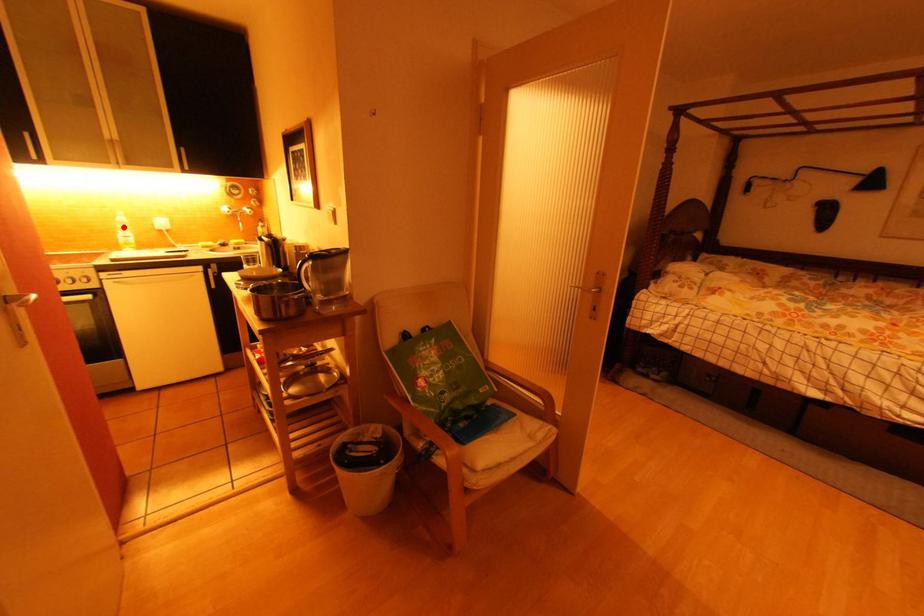
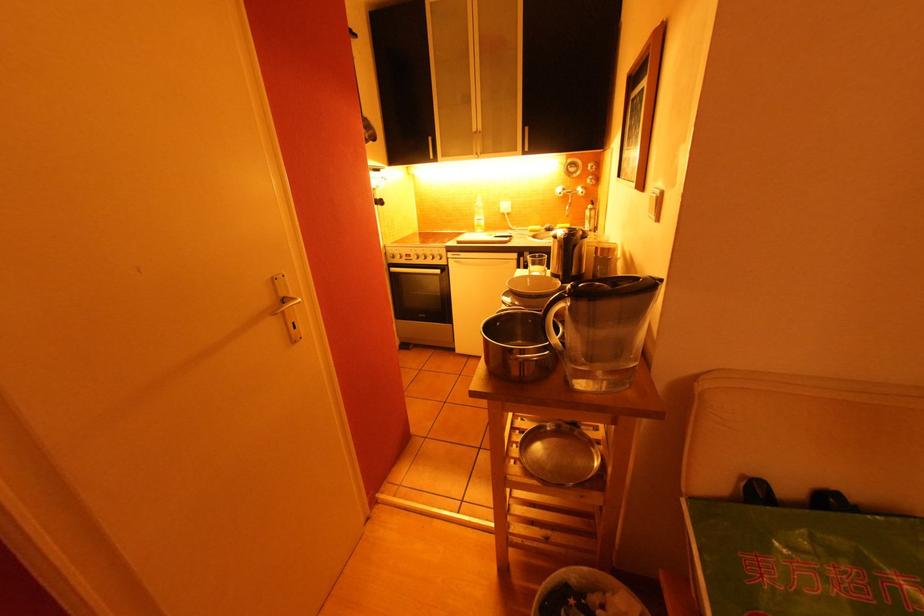
Question: I am providing you with two images of the same scene from different viewpoints. Given a red point in image1, look at the same physical point in image2. Is it:

Choices:
 (A) Closer to the viewpoint
 (B) Farther from the viewpoint

Answer: (A)